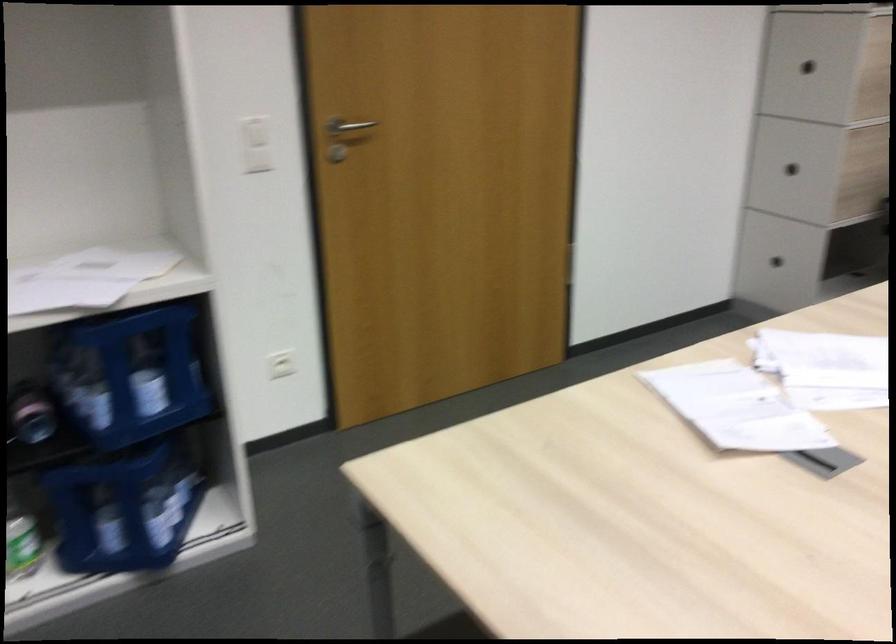
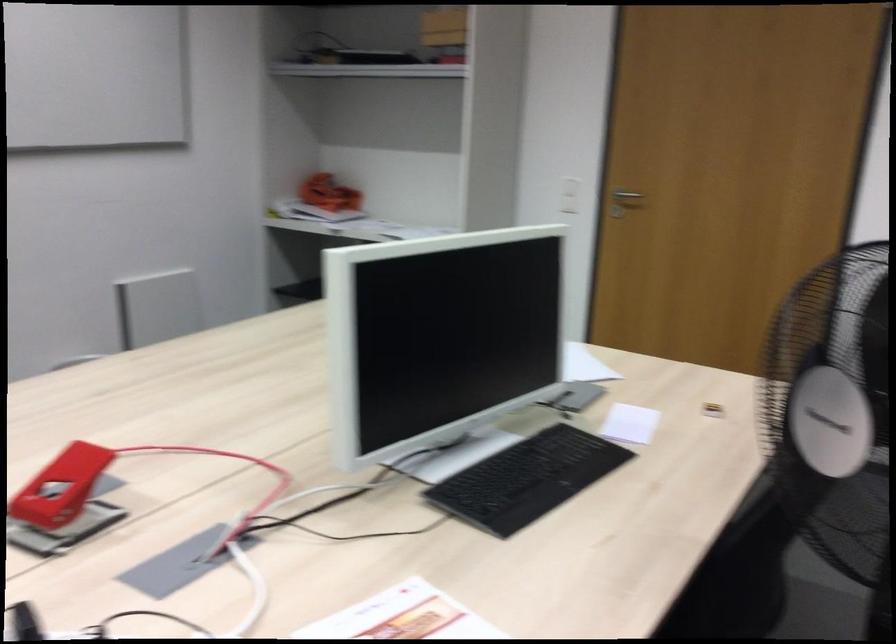
In the second image, find the point that corresponds to (291,172) in the first image.

(624, 202)